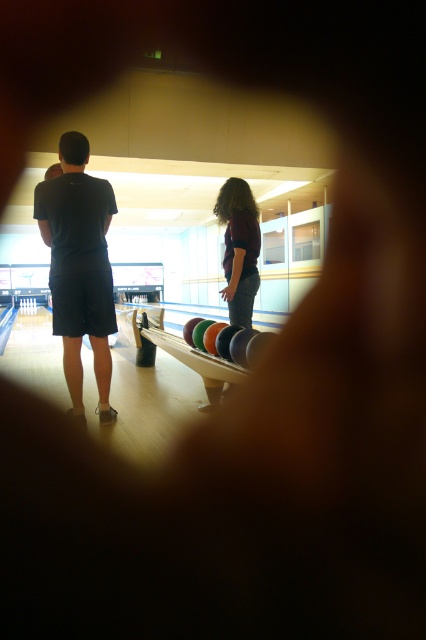
You are a photographer trying to capture the perfect shot of the dark gray shorts at center and the maroon fabric shirt at center. If you want to frame both subjects equally in your camera viewfinder, which clothing item requires you to zoom out more to fully capture its width?

The dark gray shorts at center requires zooming out more because its width surpasses that of the maroon fabric shirt at center, as stated in the description.

You are a photographer trying to capture a clear image of both the dark gray shorts at center and the maroon fabric shirt at center. Since the foreground is slightly blurred, which object would be easier to focus on?

The dark gray shorts at center is in front of the maroon fabric shirt at center, so it would be easier to focus on the dark gray shorts at center since it is closer to the camera.